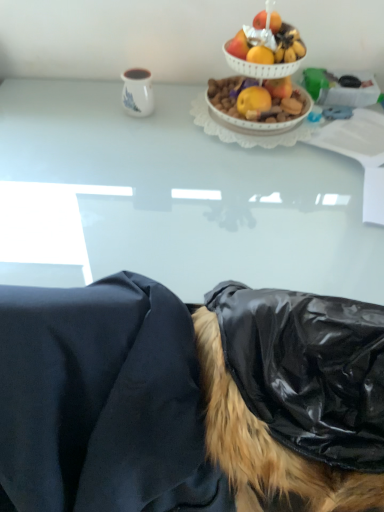
Locate an element on the screen. This screenshot has height=512, width=384. vacant region to the left of white ceramic mug at upper center is located at coordinates (83, 110).